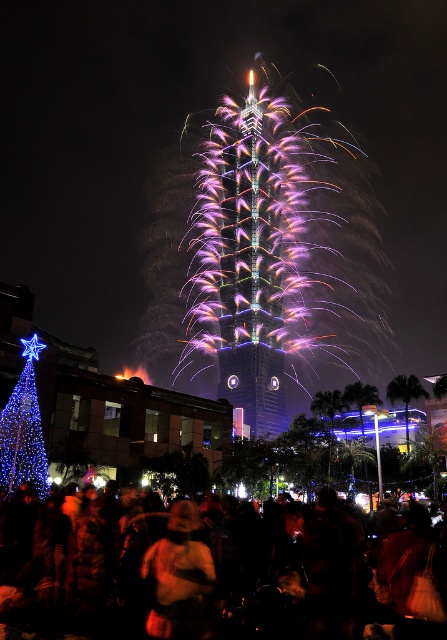
Is point (257, 620) closer to camera compared to point (8, 465)?

Yes, it is in front of point (8, 465).

Between point (408, 600) and point (41, 435), which one is positioned behind?

The point (41, 435) is more distant.

At what (x,y) coordinates should I click in order to perform the action: click on dark clothing crowd at lower center. Please return your answer as a coordinate pair (x, y). The height and width of the screenshot is (640, 447). Looking at the image, I should click on (202, 573).

Based on the photo, can you confirm if dark clothing crowd at lower center is positioned below matte gold helmet at center?

Yes, dark clothing crowd at lower center is below matte gold helmet at center.

You are a GUI agent. You are given a task and a screenshot of the screen. Output one action in this format:
    pyautogui.click(x=<x>, y=<y>)
    Task: Click on the dark clothing crowd at lower center
    The image size is (447, 640).
    Given the screenshot: What is the action you would take?
    pyautogui.click(x=202, y=573)

Is point (202, 621) closer to camera compared to point (156, 632)?

No, (202, 621) is further to viewer.

This screenshot has width=447, height=640. Find the location of `dark clothing crowd at lower center`. dark clothing crowd at lower center is located at coordinates (202, 573).

Does matte gold helmet at center lie behind blue illuminated christmas tree at left?

No.

Which is behind, point (181, 600) or point (8, 419)?

The point (8, 419) is behind.

Is point (207, 568) in front of point (30, 378)?

Yes, it is.

This screenshot has width=447, height=640. I want to click on matte gold helmet at center, so click(x=178, y=577).